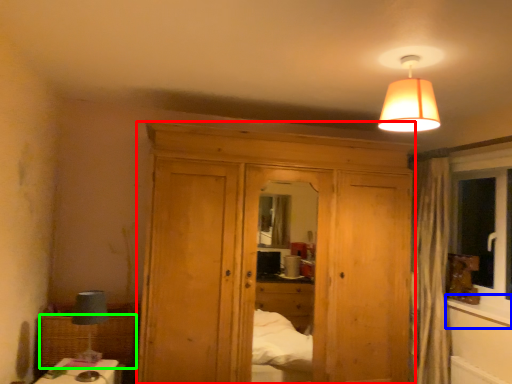
Question: Which object is the closest to the dresser (highlighted by a red box)? Choose among these: window sill (highlighted by a blue box) or picnic basket (highlighted by a green box).

Choices:
 (A) window sill
 (B) picnic basket

Answer: (B)